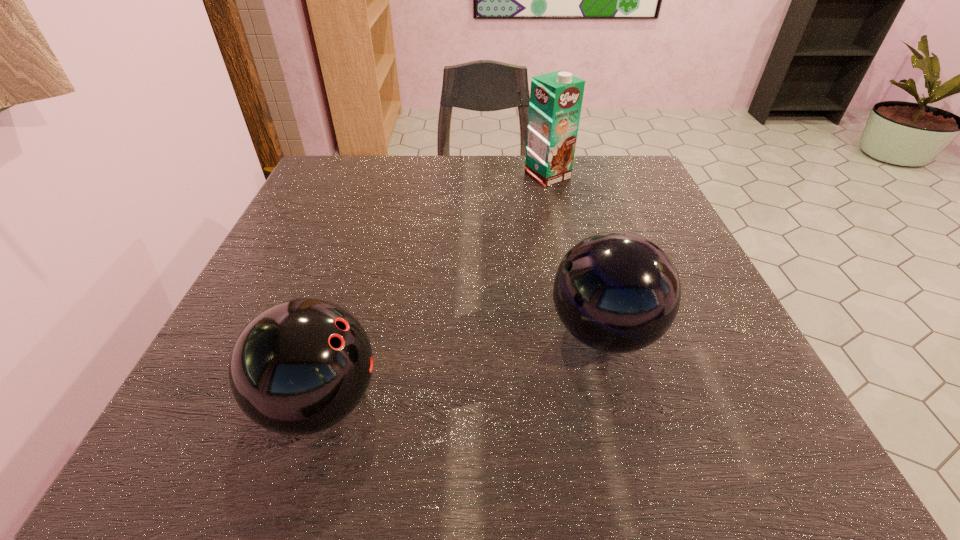
This screenshot has height=540, width=960. Find the location of `vacant space that is in between the right bowling ball and the left bowling ball`. vacant space that is in between the right bowling ball and the left bowling ball is located at coordinates (462, 367).

The image size is (960, 540). I want to click on free point between the left bowling ball and the right bowling ball, so click(x=462, y=367).

This screenshot has width=960, height=540. In order to click on unoccupied area between the carton and the left bowling ball in this screenshot , I will do `click(434, 289)`.

This screenshot has width=960, height=540. I want to click on free space between the leftmost object and the right bowling ball, so click(x=462, y=367).

Find the location of a particular element. This screenshot has width=960, height=540. unoccupied area between the leftmost object and the right bowling ball is located at coordinates (462, 367).

At what (x,y) coordinates should I click in order to perform the action: click on vacant area that lies between the right bowling ball and the left bowling ball. Please return your answer as a coordinate pair (x, y). The height and width of the screenshot is (540, 960). Looking at the image, I should click on (462, 367).

The height and width of the screenshot is (540, 960). What are the coordinates of `vacant area that lies between the farthest object and the leftmost object` in the screenshot? It's located at (434, 289).

Choose which object is the nearest neighbor to the right bowling ball. Please provide its 2D coordinates. Your answer should be formatted as a tuple, i.e. [(x, y)], where the tuple contains the x and y coordinates of a point satisfying the conditions above.

[(301, 366)]

Find the location of a particular element. The width and height of the screenshot is (960, 540). the second closest object to the farthest object is located at coordinates (301, 366).